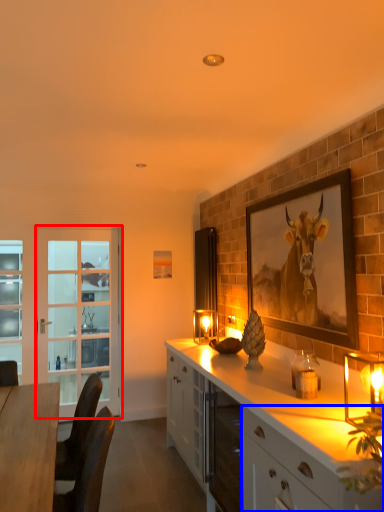
Question: Among these objects, which one is nearest to the camera, screen door (highlighted by a red box) or cabinetry (highlighted by a blue box)?

Choices:
 (A) screen door
 (B) cabinetry

Answer: (B)